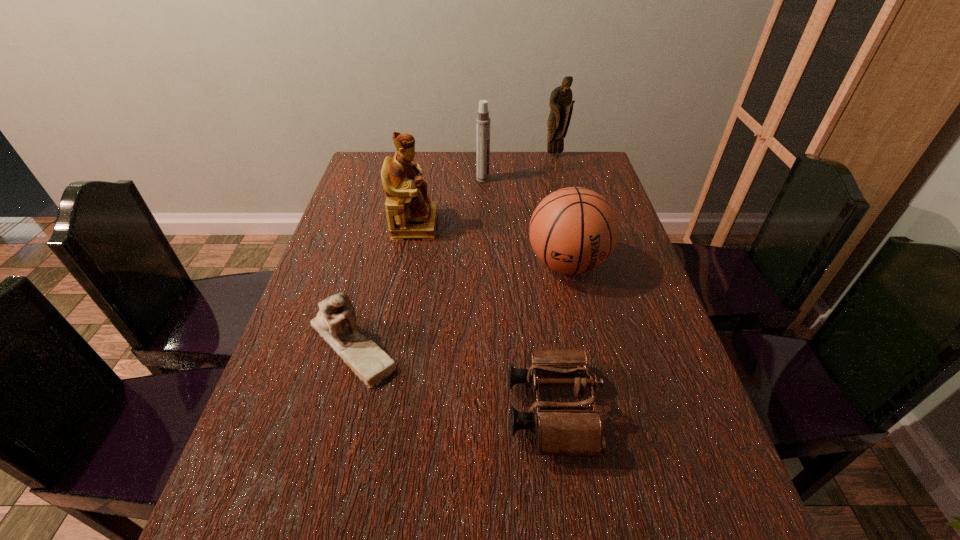
You are a GUI agent. You are given a task and a screenshot of the screen. Output one action in this format:
    pyautogui.click(x=<x>, y=<y>)
    Task: Click on the vacant space that satisfies the following two spatial constraints: 1. on the front-facing side of the farthest figurine; 2. on the front-facing side of the second farthest figurine
    This screenshot has width=960, height=540.
    Given the screenshot: What is the action you would take?
    pyautogui.click(x=572, y=224)

You are a GUI agent. You are given a task and a screenshot of the screen. Output one action in this format:
    pyautogui.click(x=<x>, y=<y>)
    Task: Click on the free point that satisfies the following two spatial constraints: 1. on the surface of the fourth tallest object near the brand logo; 2. through the eyepieces of the shortest object
    The image size is (960, 540).
    Given the screenshot: What is the action you would take?
    pyautogui.click(x=599, y=410)

Locate an element on the screen. This screenshot has width=960, height=540. free location that satisfies the following two spatial constraints: 1. on the front-facing side of the farthest figurine; 2. through the eyepieces of the shortest object is located at coordinates (620, 410).

At what (x,y) coordinates should I click in order to perform the action: click on free spot that satisfies the following two spatial constraints: 1. on the surface of the third shortest object near the brand logo; 2. through the eyepieces of the shortest object. Please return your answer as a coordinate pair (x, y). Looking at the image, I should click on (599, 410).

At what (x,y) coordinates should I click in order to perform the action: click on blank space that satisfies the following two spatial constraints: 1. on the front-facing side of the farthest figurine; 2. on the front-facing side of the second nearest figurine. Please return your answer as a coordinate pair (x, y). The image size is (960, 540). Looking at the image, I should click on (572, 224).

At what (x,y) coordinates should I click in order to perform the action: click on free point that satisfies the following two spatial constraints: 1. on the front-facing side of the second farthest figurine; 2. on the front-facing side of the fifth tallest object. Please return your answer as a coordinate pair (x, y). The height and width of the screenshot is (540, 960). Looking at the image, I should click on (393, 344).